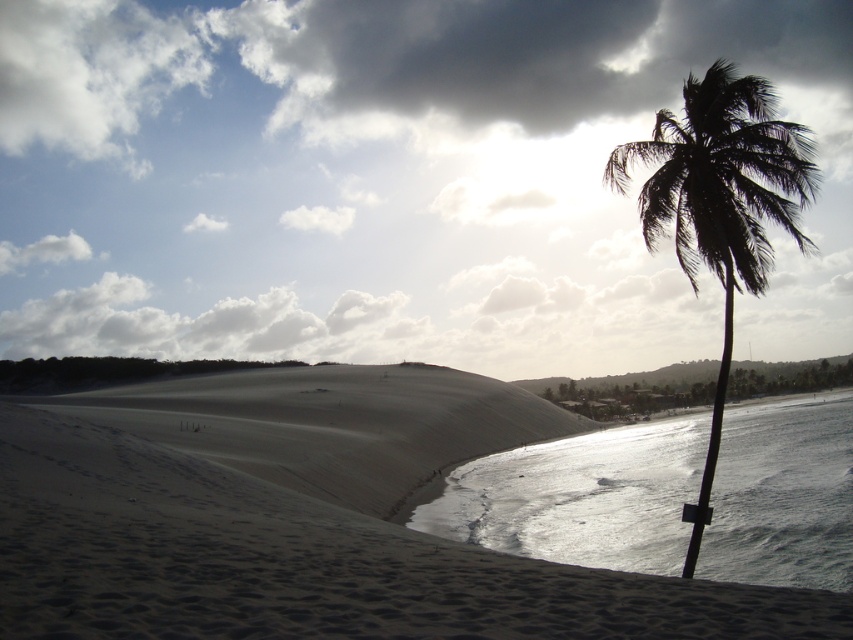
You are standing at the base of the sand dune in the image and want to reach the top. There are two markers labeled point (186,560) and point (726,179). Which marker is closer to you as you start climbing the dune?

Point (186,560) is closer to the camera than point (726,179), so the marker labeled point (186,560) is closer to you as you start climbing the dune.

You are standing on the sand dune and want to walk towards the palm tree. There are two points marked on the dune, point [581,568] and point [621,448]. Which point should you step on first to get closer to the palm tree?

You should step on point [581,568] first because it is closer to the viewer, meaning it is nearer to your current position on the sand dune, and thus closer to the palm tree located to the right of the frame.